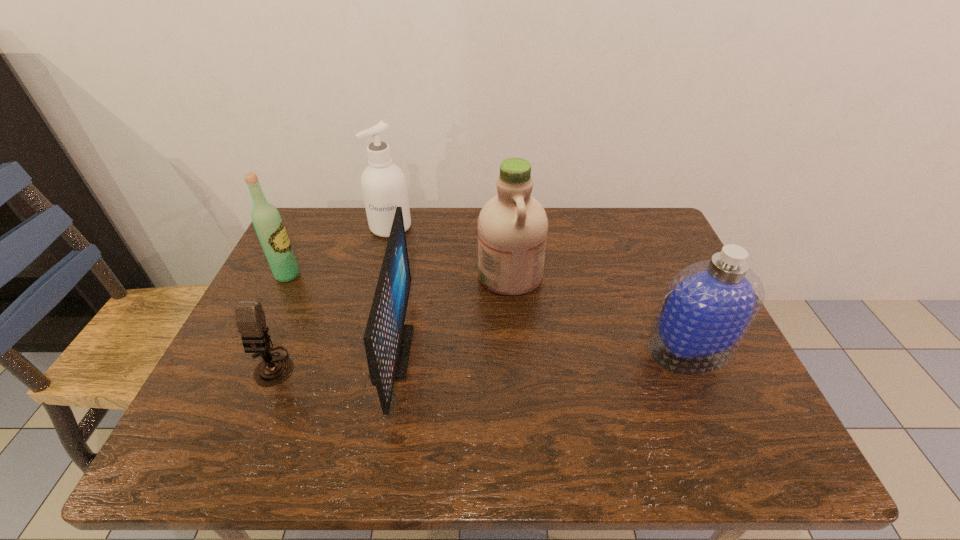
The height and width of the screenshot is (540, 960). I want to click on microphone at the left edge, so click(x=250, y=318).

Find the location of a particular element. The width and height of the screenshot is (960, 540). object that is at the right edge is located at coordinates (708, 307).

You are a GUI agent. You are given a task and a screenshot of the screen. Output one action in this format:
    pyautogui.click(x=<x>, y=<y>)
    Task: Click on the blank space at the far edge of the desktop
    The image size is (960, 540).
    Given the screenshot: What is the action you would take?
    pyautogui.click(x=444, y=239)

The width and height of the screenshot is (960, 540). Find the location of `vacant space at the left edge`. vacant space at the left edge is located at coordinates (238, 408).

The width and height of the screenshot is (960, 540). I want to click on free space at the right edge of the desktop, so click(656, 275).

The height and width of the screenshot is (540, 960). In the image, there is a desktop. Identify the location of vacant space at the far left corner. (350, 217).

You are a GUI agent. You are given a task and a screenshot of the screen. Output one action in this format:
    pyautogui.click(x=<x>, y=<y>)
    Task: Click on the vacant region at the far right corner of the desktop
    
    Given the screenshot: What is the action you would take?
    pyautogui.click(x=619, y=220)

Locate an element on the screen. This screenshot has height=540, width=960. unoccupied area between the microphone and the computer monitor is located at coordinates (332, 359).

Locate an element on the screen. Image resolution: width=960 pixels, height=540 pixels. free space between the computer monitor and the wine bottle is located at coordinates (340, 314).

You are a GUI agent. You are given a task and a screenshot of the screen. Output one action in this format:
    pyautogui.click(x=<x>, y=<y>)
    Task: Click on the vacant area that lies between the computer monitor and the second object from right to left
    
    Given the screenshot: What is the action you would take?
    pyautogui.click(x=451, y=313)